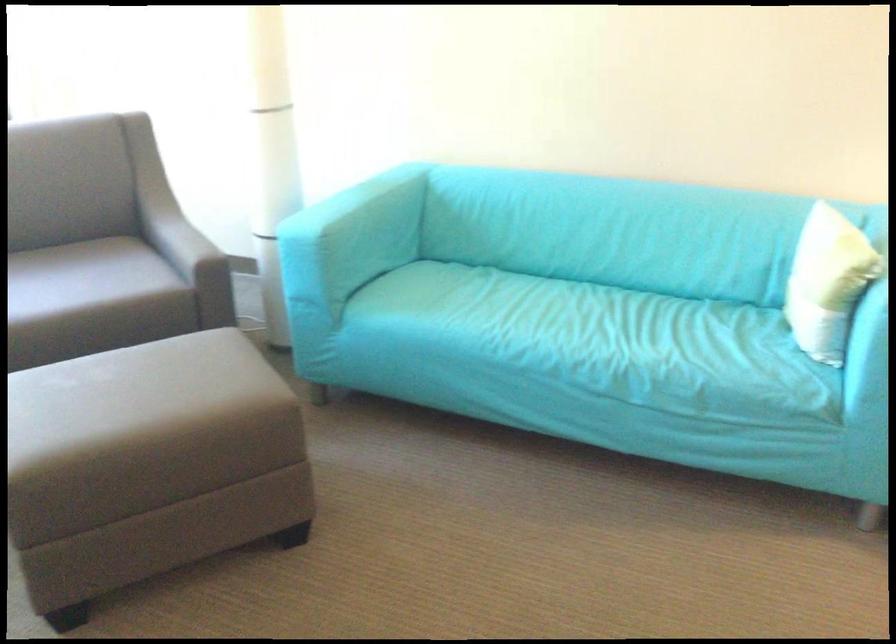
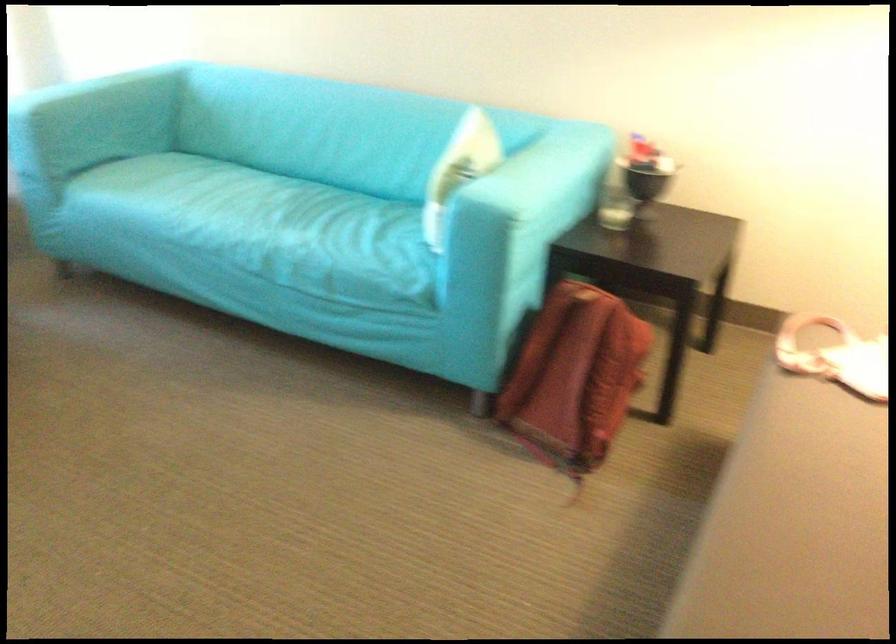
Question: What movement of the cameraman would produce the second image?

Choices:
 (A) Left
 (B) Right
 (C) Forward
 (D) Backward

Answer: (B)